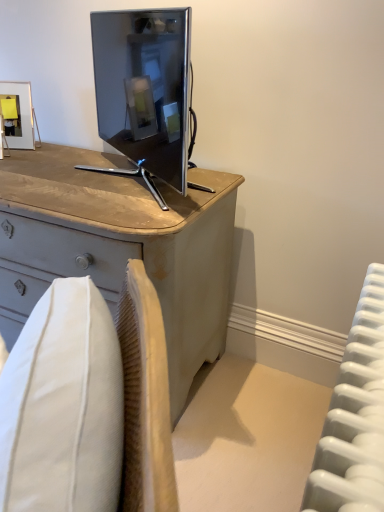
Question: Does metallic gold picture frame at upper left turn towards white plastic radiator at right?

Choices:
 (A) no
 (B) yes

Answer: (A)

Question: Does metallic gold picture frame at upper left have a smaller size compared to white plastic radiator at right?

Choices:
 (A) yes
 (B) no

Answer: (A)

Question: Considering the relative positions of metallic gold picture frame at upper left and white plastic radiator at right in the image provided, is metallic gold picture frame at upper left to the left of white plastic radiator at right from the viewer's perspective?

Choices:
 (A) yes
 (B) no

Answer: (A)

Question: Considering the relative sizes of metallic gold picture frame at upper left and white plastic radiator at right in the image provided, is metallic gold picture frame at upper left thinner than white plastic radiator at right?

Choices:
 (A) no
 (B) yes

Answer: (B)

Question: From the image's perspective, is metallic gold picture frame at upper left beneath white plastic radiator at right?

Choices:
 (A) no
 (B) yes

Answer: (A)

Question: Is metallic gold picture frame at upper left shorter than white plastic radiator at right?

Choices:
 (A) no
 (B) yes

Answer: (B)

Question: From the image's perspective, does white plastic radiator at right appear lower than light gray wood desk at center?

Choices:
 (A) no
 (B) yes

Answer: (B)

Question: Can you confirm if white plastic radiator at right is thinner than light gray wood desk at center?

Choices:
 (A) yes
 (B) no

Answer: (A)

Question: Is white plastic radiator at right to the left of light gray wood desk at center from the viewer's perspective?

Choices:
 (A) yes
 (B) no

Answer: (B)

Question: Is white plastic radiator at right located outside light gray wood desk at center?

Choices:
 (A) no
 (B) yes

Answer: (B)

Question: From the image's perspective, is white plastic radiator at right above light gray wood desk at center?

Choices:
 (A) no
 (B) yes

Answer: (A)

Question: Does white plastic radiator at right appear on the right side of light gray wood desk at center?

Choices:
 (A) no
 (B) yes

Answer: (B)

Question: From the image's perspective, is light gray wood desk at center beneath metallic gold picture frame at upper left?

Choices:
 (A) yes
 (B) no

Answer: (A)